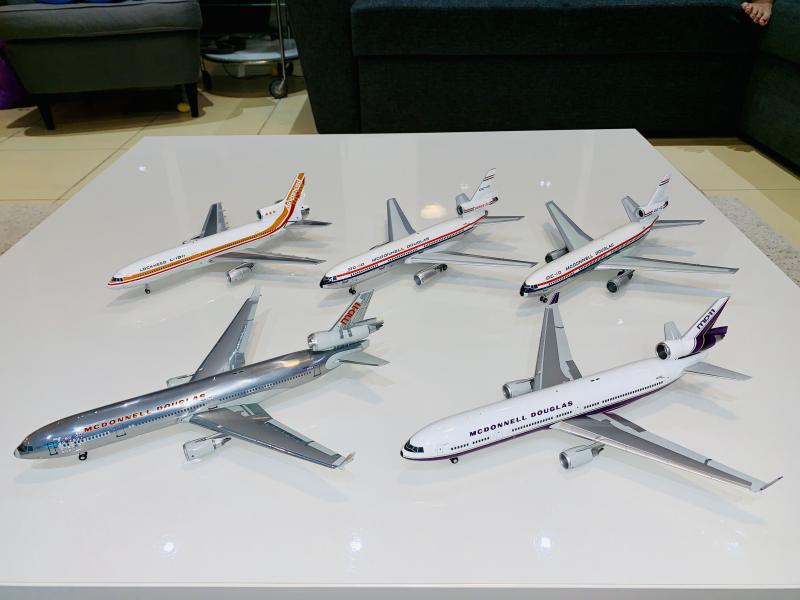
Image resolution: width=800 pixels, height=600 pixels. Find the location of `rug`. rug is located at coordinates (754, 229), (10, 216).